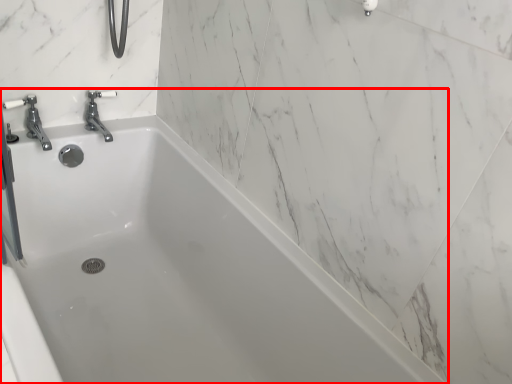
Question: From the image, what is the correct spatial relationship of bathtub (annotated by the red box) in relation to tap?

Choices:
 (A) right
 (B) left

Answer: (A)